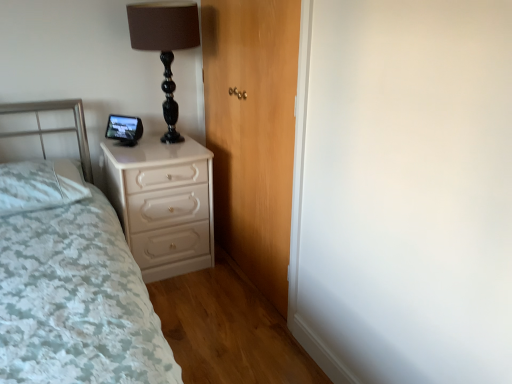
What do you see at coordinates (165, 45) in the screenshot? I see `black glossy table lamp at upper center` at bounding box center [165, 45].

This screenshot has width=512, height=384. Describe the element at coordinates (252, 132) in the screenshot. I see `wooden door at center` at that location.

Describe the element at coordinates (163, 203) in the screenshot. I see `white glossy chest of drawers at lower left` at that location.

The image size is (512, 384). Identify the location of white glossy chest of drawers at lower left. (163, 203).

At what (x,y) coordinates should I click in order to perform the action: click on black glossy table lamp at upper center. Please return your answer as a coordinate pair (x, y). The width and height of the screenshot is (512, 384). Looking at the image, I should click on (165, 45).

Does white textured bed at left lie in front of white soft pillow at left?

Yes, the depth of white textured bed at left is less than that of white soft pillow at left.

Could you tell me if white textured bed at left is turned towards white soft pillow at left?

No, white textured bed at left is not oriented towards white soft pillow at left.

In terms of height, does white textured bed at left look taller or shorter compared to white soft pillow at left?

In the image, white textured bed at left appears to be taller than white soft pillow at left.

Is there a large distance between white textured bed at left and white soft pillow at left?

white textured bed at left is actually quite close to white soft pillow at left.

Which of these two, white soft pillow at left or wooden door at center, stands taller?

Standing taller between the two is wooden door at center.

Does white soft pillow at left have a larger size compared to wooden door at center?

No, white soft pillow at left is not bigger than wooden door at center.

Is white soft pillow at left positioned in front of wooden door at center?

No, white soft pillow at left is behind wooden door at center.

Can you confirm if white soft pillow at left is positioned to the left of wooden door at center?

Yes.

Find the location of `pillow that appears behind the white textured bed at left`. pillow that appears behind the white textured bed at left is located at coordinates (40, 185).

Would you say white soft pillow at left is a long distance from white textured bed at left?

white soft pillow at left is near white textured bed at left, not far away.

Is white soft pillow at left situated inside white textured bed at left or outside?

white soft pillow at left is inside white textured bed at left.

From the image's perspective, which object appears higher, white soft pillow at left or white textured bed at left?

white soft pillow at left.

From the picture: Could you tell me if white soft pillow at left is facing white glossy chest of drawers at lower left?

No, white soft pillow at left is not turned towards white glossy chest of drawers at lower left.

Visually, is white soft pillow at left positioned to the left or to the right of white glossy chest of drawers at lower left?

white soft pillow at left is positioned on white glossy chest of drawers at lower left's left side.

Is white soft pillow at left bigger than white glossy chest of drawers at lower left?

No, white soft pillow at left is not bigger than white glossy chest of drawers at lower left.

Are wooden door at center and white glossy chest of drawers at lower left beside each other?

wooden door at center is not next to white glossy chest of drawers at lower left, and they're not touching.

Based on the photo, is wooden door at center facing away from white glossy chest of drawers at lower left?

That's right, wooden door at center is facing away from white glossy chest of drawers at lower left.

How many degrees apart are the facing directions of wooden door at center and white glossy chest of drawers at lower left?

wooden door at center and white glossy chest of drawers at lower left are facing 91.7 degrees away from each other.

Would you say wooden door at center contains white glossy chest of drawers at lower left?

Definitely not — white glossy chest of drawers at lower left is not inside wooden door at center.

Can you tell me how much black glossy table lamp at upper center and wooden door at center differ in facing direction?

black glossy table lamp at upper center and wooden door at center are facing 90.1 degrees away from each other.

Does black glossy table lamp at upper center turn towards wooden door at center?

No, black glossy table lamp at upper center is not aimed at wooden door at center.

Looking at the image, does black glossy table lamp at upper center seem bigger or smaller compared to wooden door at center?

black glossy table lamp at upper center is smaller than wooden door at center.

Is black glossy table lamp at upper center next to wooden door at center and touching it?

black glossy table lamp at upper center and wooden door at center are not in contact.

Is white soft pillow at left a part of white glossy chest of drawers at lower left?

A: No, white soft pillow at left is not inside white glossy chest of drawers at lower left.

Is white glossy chest of drawers at lower left taller than white soft pillow at left?

Yes.

From the image's perspective, which object appears higher, white glossy chest of drawers at lower left or white soft pillow at left?

white soft pillow at left.

Considering the positions of objects white glossy chest of drawers at lower left and white soft pillow at left in the image provided, who is in front, white glossy chest of drawers at lower left or white soft pillow at left?

white soft pillow at left is closer to the camera.

The height and width of the screenshot is (384, 512). I want to click on bed below the white soft pillow at left (from a real-world perspective), so click(x=71, y=279).

This screenshot has width=512, height=384. What are the coordinates of `door in front of the white soft pillow at left` in the screenshot? It's located at (252, 132).

From the image, which object appears to be farther from white glossy chest of drawers at lower left, white textured bed at left or white soft pillow at left?

white textured bed at left is positioned further to the anchor white glossy chest of drawers at lower left.

From the image, which object appears to be nearer to white soft pillow at left, white textured bed at left or wooden door at center?

Based on the image, white textured bed at left appears to be nearer to white soft pillow at left.

Looking at the image, which one is located closer to black glossy table lamp at upper center, white soft pillow at left or wooden door at center?

wooden door at center is positioned closer to the anchor black glossy table lamp at upper center.

Based on the photo, considering their positions, is white soft pillow at left positioned further to white glossy chest of drawers at lower left than wooden door at center?

The object further to white glossy chest of drawers at lower left is wooden door at center.

Based on their spatial positions, is white soft pillow at left or black glossy table lamp at upper center closer to white glossy chest of drawers at lower left?

The object closer to white glossy chest of drawers at lower left is white soft pillow at left.

Considering their positions, is black glossy table lamp at upper center positioned closer to white textured bed at left than white glossy chest of drawers at lower left?

white glossy chest of drawers at lower left is closer to white textured bed at left.

Estimate the real-world distances between objects in this image. Which object is further from white textured bed at left, white soft pillow at left or white glossy chest of drawers at lower left?

white glossy chest of drawers at lower left.

From the image, which object appears to be nearer to white textured bed at left, white soft pillow at left or wooden door at center?

white soft pillow at left is closer to white textured bed at left.

Find the location of `pillow between white textured bed at left and black glossy table lamp at upper center from front to back`. pillow between white textured bed at left and black glossy table lamp at upper center from front to back is located at coordinates (40, 185).

Identify the location of table lamp located between white textured bed at left and white glossy chest of drawers at lower left in the depth direction. (165, 45).

Where is `door positioned between white textured bed at left and white glossy chest of drawers at lower left from near to far`? Image resolution: width=512 pixels, height=384 pixels. door positioned between white textured bed at left and white glossy chest of drawers at lower left from near to far is located at coordinates (252, 132).

Locate an element on the screen. This screenshot has width=512, height=384. chest of drawers between white soft pillow at left and wooden door at center from left to right is located at coordinates (163, 203).